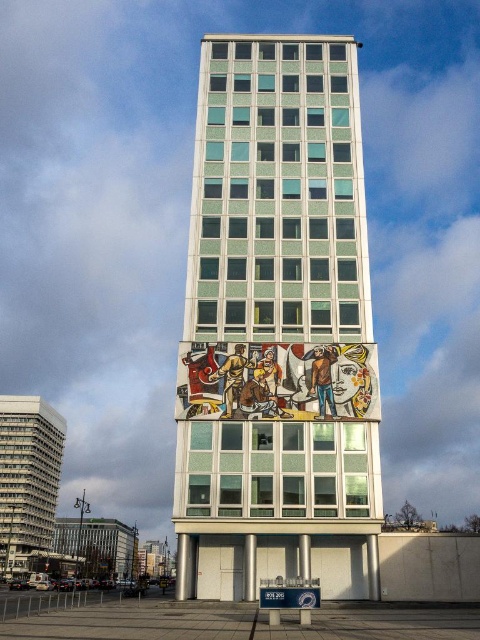
You are standing in front of a cityscape with two buildings. You see the white glossy building at center and the matte gray building at left. Which building is nearer to you?

The white glossy building at center is closer to the viewer than the matte gray building at left.

You are standing in front of the modern building and want to locate two specific points marked on the facade. The first point is at coordinates point [288,275] and the second is at point [48,477]. Which of these points is closer to you?

Point [288,275] is in front of point [48,477], so it is closer to you.